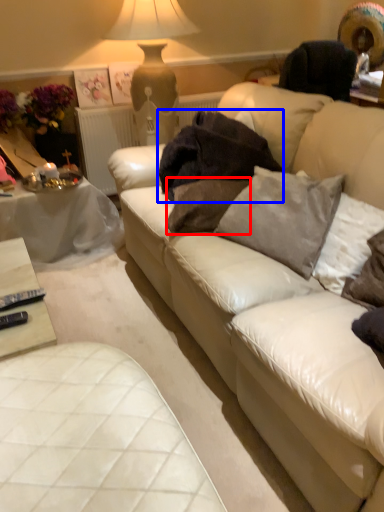
Question: Which object appears closest to the camera in this image, pillow (highlighted by a red box) or blanket (highlighted by a blue box)?

Choices:
 (A) pillow
 (B) blanket

Answer: (A)